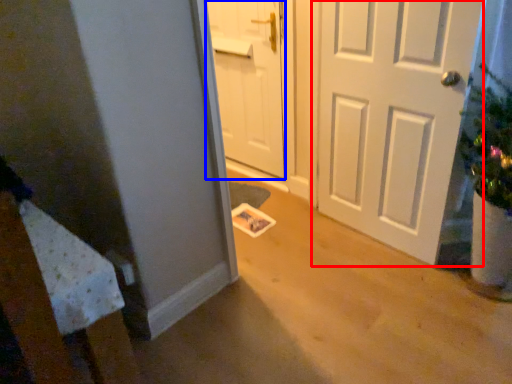
Question: Which object is closer to the camera taking this photo, door (highlighted by a red box) or door (highlighted by a blue box)?

Choices:
 (A) door
 (B) door

Answer: (A)